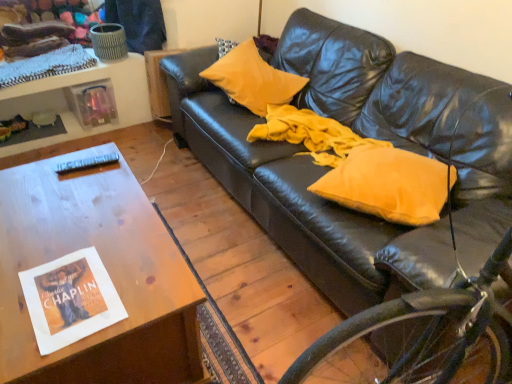
I want to click on free spot to the right of black plastic remote control at upper left, so click(111, 170).